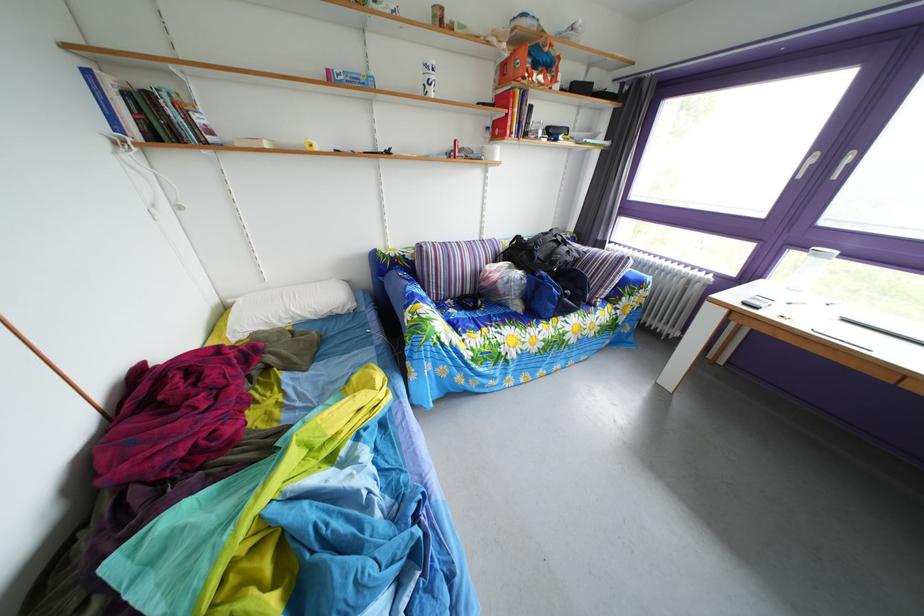
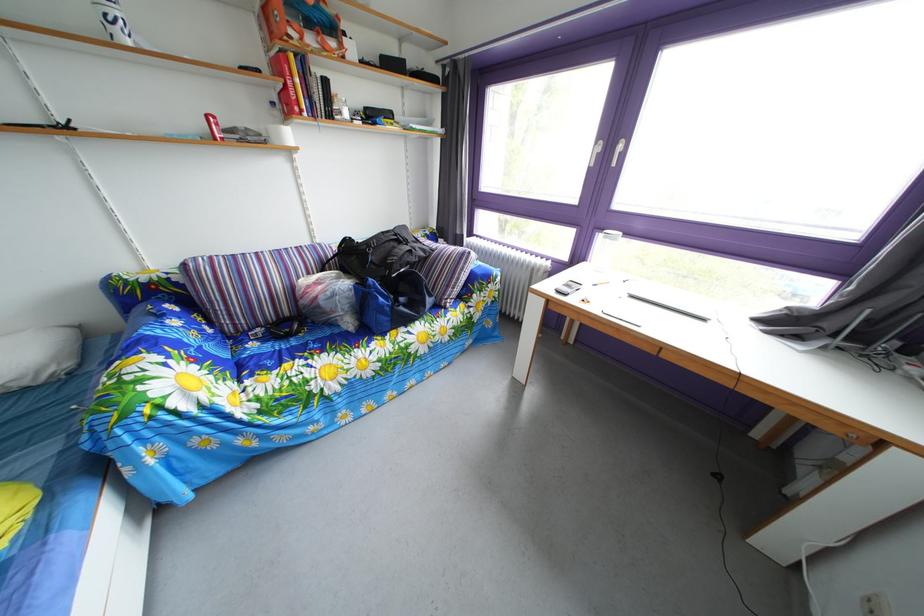
In the second image, find the point that corresponds to [499,137] in the first image.

(284, 111)